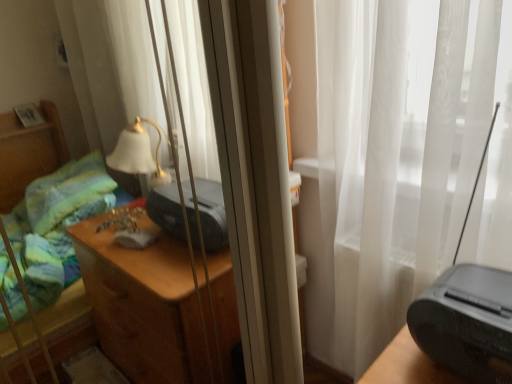
Measure the distance between point (149,199) and camera.

A distance of 1.32 meters exists between point (149,199) and camera.

What is the approximate width of black plastic radio at right?

It is 9.27 inches.

Find the location of a particular element. The image size is (512, 384). white sheer curtain at center is located at coordinates (197, 113).

Image resolution: width=512 pixels, height=384 pixels. I want to click on matte black printer at center, arranged as the second printer when viewed from the front, so click(x=211, y=214).

How far apart are black plastic printer at right, the 2th printer from the left, and matte black printer at center, arranged as the second printer when viewed from the front?

black plastic printer at right, the 2th printer from the left, and matte black printer at center, arranged as the second printer when viewed from the front, are 25.89 inches apart from each other.

From the image's perspective, which one is positioned higher, black plastic printer at right, which is the 1th printer from right to left, or matte black printer at center, arranged as the second printer when viewed from the front?

From the image's view, matte black printer at center, arranged as the second printer when viewed from the front, is above.

You are a GUI agent. You are given a task and a screenshot of the screen. Output one action in this format:
    pyautogui.click(x=<x>, y=<y>)
    Task: Click on the printer in front of the matte black printer at center, positioned as the 1th printer in left-to-right order
    
    Given the screenshot: What is the action you would take?
    pyautogui.click(x=467, y=322)

Considering the positions of objects black plastic printer at right, the 2th printer from the left, and matte black printer at center, arranged as the 2th printer when viewed from the right, in the image provided, who is more to the left, black plastic printer at right, the 2th printer from the left, or matte black printer at center, arranged as the 2th printer when viewed from the right,?

matte black printer at center, arranged as the 2th printer when viewed from the right, is more to the left.

Choose the correct answer: Is white sheer curtain at center inside black plastic printer at right, which is counted as the 1th printer, starting from the front, or outside it?

→ The correct answer is: outside.

Considering the sizes of white sheer curtain at center and black plastic printer at right, which is counted as the 1th printer, starting from the front, in the image, is white sheer curtain at center taller or shorter than black plastic printer at right, which is counted as the 1th printer, starting from the front,?

white sheer curtain at center is taller than black plastic printer at right, which is counted as the 1th printer, starting from the front.

How far apart are white sheer curtain at center and black plastic printer at right, the 2th printer from the left?

The distance of white sheer curtain at center from black plastic printer at right, the 2th printer from the left, is 31.97 inches.

Looking at their sizes, would you say white sheer curtain at center is wider or thinner than black plastic printer at right, which is the 1th printer from right to left?

Considering their sizes, white sheer curtain at center looks broader than black plastic printer at right, which is the 1th printer from right to left.

Is matte black printer at center, arranged as the 2th printer when viewed from the right, surrounding black plastic printer at right, positioned as the second printer in back-to-front order?

Actually, black plastic printer at right, positioned as the second printer in back-to-front order, is outside matte black printer at center, arranged as the 2th printer when viewed from the right.

Where is `printer that is on the left side of black plastic printer at right, which is the 1th printer from right to left`? printer that is on the left side of black plastic printer at right, which is the 1th printer from right to left is located at coordinates (211, 214).

In the scene shown: Could you tell me if matte black printer at center, arranged as the 2th printer when viewed from the right, is facing black plastic printer at right, positioned as the second printer in back-to-front order?

Yes, matte black printer at center, arranged as the 2th printer when viewed from the right, is aimed at black plastic printer at right, positioned as the second printer in back-to-front order.

In the scene shown: From the image's perspective, is matte black printer at center, arranged as the 2th printer when viewed from the right, on black plastic printer at right, which is the 1th printer from right to left?

Yes, from the image's perspective, matte black printer at center, arranged as the 2th printer when viewed from the right, is above black plastic printer at right, which is the 1th printer from right to left.

Is black plastic printer at right, which is counted as the 1th printer, starting from the front, taller than black plastic radio at right?

In fact, black plastic printer at right, which is counted as the 1th printer, starting from the front, may be shorter than black plastic radio at right.

From the image's perspective, does black plastic printer at right, which is counted as the 1th printer, starting from the front, appear higher than black plastic radio at right?

Actually, black plastic printer at right, which is counted as the 1th printer, starting from the front, appears below black plastic radio at right in the image.

Considering the positions of objects black plastic printer at right, which is counted as the 1th printer, starting from the front, and black plastic radio at right in the image provided, who is more to the left, black plastic printer at right, which is counted as the 1th printer, starting from the front, or black plastic radio at right?

black plastic radio at right.

From a real-world perspective, is matte black printer at center, arranged as the 2th printer when viewed from the right, physically located above or below white sheer curtain at center?

matte black printer at center, arranged as the 2th printer when viewed from the right, is situated lower than white sheer curtain at center in the real world.

Is matte black printer at center, which is the 1th printer in back-to-front order, beside white sheer curtain at center?

No, matte black printer at center, which is the 1th printer in back-to-front order, is not next to white sheer curtain at center.

Does matte black printer at center, which is the 1th printer in back-to-front order, have a lesser height compared to white sheer curtain at center?

Yes, matte black printer at center, which is the 1th printer in back-to-front order, is shorter than white sheer curtain at center.

From the image's perspective, does matte black printer at center, arranged as the second printer when viewed from the front, appear higher than white sheer curtain at center?

No, from the image's perspective, matte black printer at center, arranged as the second printer when viewed from the front, is not on top of white sheer curtain at center.

Which of these two, matte black printer at center, arranged as the 2th printer when viewed from the right, or black plastic radio at right, is thinner?

With smaller width is matte black printer at center, arranged as the 2th printer when viewed from the right.

Is matte black printer at center, which is the 1th printer in back-to-front order, turned away from black plastic radio at right?

No, matte black printer at center, which is the 1th printer in back-to-front order, is not facing away from black plastic radio at right.

Is black plastic radio at right surrounded by matte black printer at center, arranged as the 2th printer when viewed from the right?

Actually, black plastic radio at right is outside matte black printer at center, arranged as the 2th printer when viewed from the right.

In terms of size, does matte black printer at center, arranged as the second printer when viewed from the front, appear bigger or smaller than black plastic radio at right?

Considering their sizes, matte black printer at center, arranged as the second printer when viewed from the front, takes up less space than black plastic radio at right.

Considering the positions of points (435, 334) and (201, 220), is point (435, 334) closer to camera compared to point (201, 220)?

Yes.

Looking at their sizes, would you say black plastic radio at right is wider or thinner than matte black printer at center, which is the 1th printer in back-to-front order?

black plastic radio at right is wider than matte black printer at center, which is the 1th printer in back-to-front order.

From the image's perspective, which one is positioned higher, black plastic radio at right or matte black printer at center, arranged as the second printer when viewed from the front?

matte black printer at center, arranged as the second printer when viewed from the front.

Could you tell me if black plastic radio at right is turned towards matte black printer at center, arranged as the 2th printer when viewed from the right?

No, black plastic radio at right is not aimed at matte black printer at center, arranged as the 2th printer when viewed from the right.

Identify the location of printer on the left of the black plastic printer at right, positioned as the second printer in back-to-front order. The image size is (512, 384). (211, 214).

Locate an element on the screen. curtain above the black plastic printer at right, which is counted as the 1th printer, starting from the front (from the image's perspective) is located at coordinates (197, 113).

Based on their spatial positions, is white sheer curtain at center or black plastic radio at right further from matte black printer at center, which is the 1th printer in back-to-front order?

black plastic radio at right.

Looking at the image, which one is located further to white sheer curtain at center, black plastic printer at right, which is the 1th printer from right to left, or black plastic radio at right?

The object further to white sheer curtain at center is black plastic printer at right, which is the 1th printer from right to left.

When comparing their distances from black plastic radio at right, does matte black printer at center, which is the 1th printer in back-to-front order, or white sheer curtain at center seem further?

white sheer curtain at center.

Estimate the real-world distances between objects in this image. Which object is closer to matte black printer at center, arranged as the 2th printer when viewed from the right, white sheer curtain at center or black plastic printer at right, which is counted as the 1th printer, starting from the front?

white sheer curtain at center.

When comparing their distances from white sheer curtain at center, does matte black printer at center, arranged as the second printer when viewed from the front, or black plastic printer at right, which is counted as the 1th printer, starting from the front, seem closer?

Based on the image, matte black printer at center, arranged as the second printer when viewed from the front, appears to be nearer to white sheer curtain at center.

Considering their positions, is black plastic printer at right, positioned as the second printer in back-to-front order, positioned further to white sheer curtain at center than matte black printer at center, arranged as the second printer when viewed from the front?

black plastic printer at right, positioned as the second printer in back-to-front order, is positioned further to the anchor white sheer curtain at center.

Looking at the image, which one is located closer to matte black printer at center, arranged as the second printer when viewed from the front, black plastic printer at right, the 2th printer from the left, or white sheer curtain at center?

Based on the image, white sheer curtain at center appears to be nearer to matte black printer at center, arranged as the second printer when viewed from the front.

Considering their positions, is matte black printer at center, arranged as the 2th printer when viewed from the right, positioned further to white sheer curtain at center than black plastic radio at right?

Among the two, black plastic radio at right is located further to white sheer curtain at center.

Locate an element on the screen. Image resolution: width=512 pixels, height=384 pixels. curtain located between matte black printer at center, which is the 1th printer in back-to-front order, and black plastic printer at right, which is the 1th printer from right to left, in the left-right direction is located at coordinates (197, 113).

What are the coordinates of `equipment situated between white sheer curtain at center and black plastic printer at right, positioned as the second printer in back-to-front order, from left to right` in the screenshot? It's located at (468, 314).

Image resolution: width=512 pixels, height=384 pixels. Identify the location of curtain between black plastic radio at right and matte black printer at center, which is the 1th printer in back-to-front order, from front to back. (197, 113).

Identify the location of printer between black plastic radio at right and matte black printer at center, positioned as the 1th printer in left-to-right order, from front to back. point(467,322).